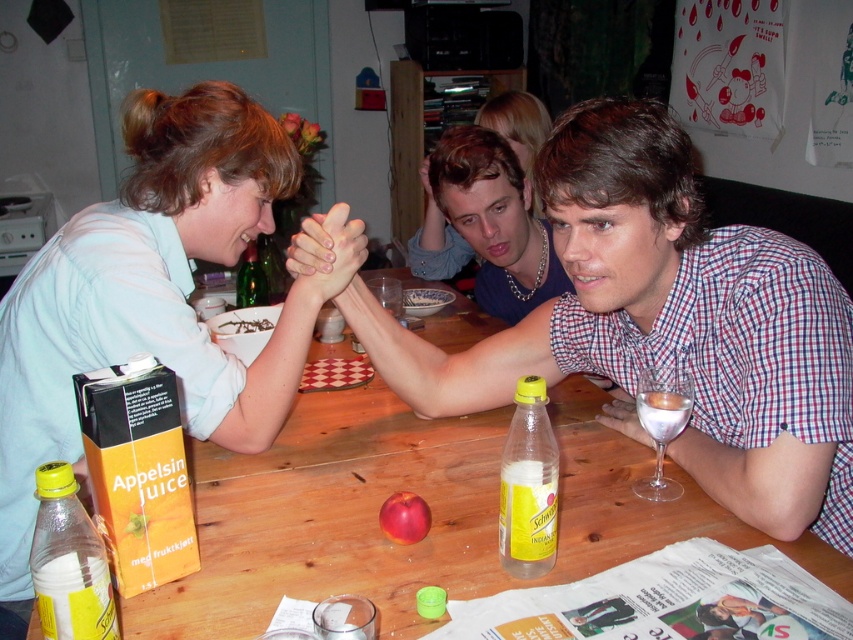
You are a delivery person who needs to place a small package between the yellow matte bottle at lower left and the yellow plastic bottle at center. Can you fit it if the package is 15 inches long?

The yellow matte bottle at lower left is 14.56 inches from the yellow plastic bottle at center, so the package cannot fit as it is slightly longer than the available space between them.